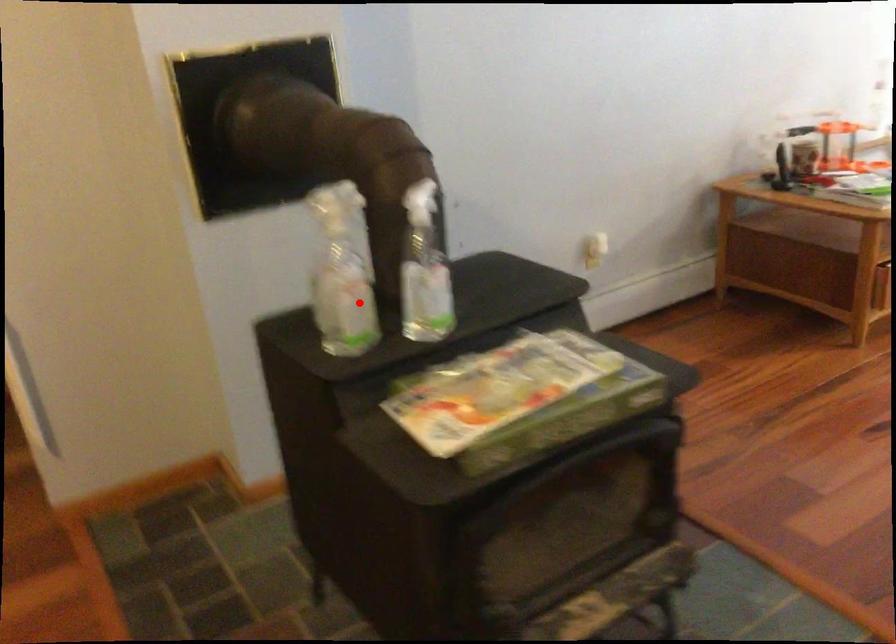
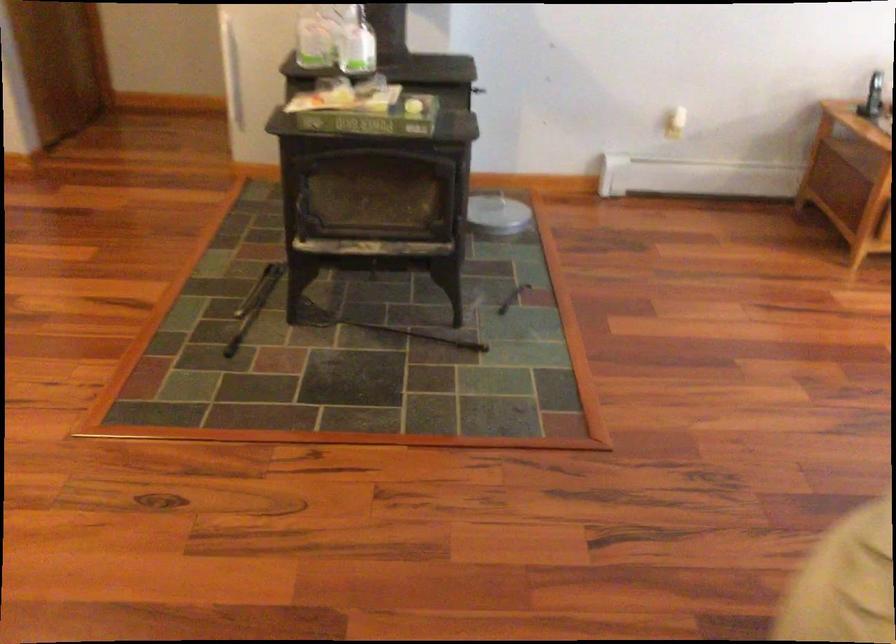
Locate, in the second image, the point that corresponds to the highlighted location in the first image.

(314, 41)